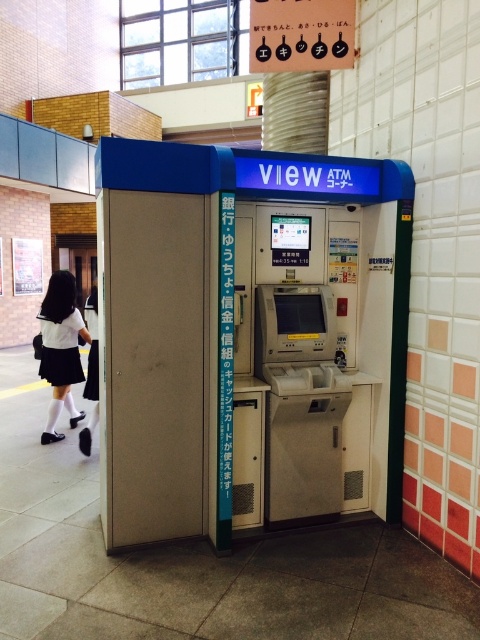
Question: Which of the following is the farthest from the observer?

Choices:
 (A) (66, 364)
 (B) (252, 397)

Answer: (A)

Question: Which point is farther to the camera?

Choices:
 (A) (216, 308)
 (B) (61, 376)

Answer: (B)

Question: Is matte plastic atm at center wider than white matte skirt at lower left?

Choices:
 (A) no
 (B) yes

Answer: (B)

Question: Is matte plastic atm at center wider than white matte skirt at lower left?

Choices:
 (A) no
 (B) yes

Answer: (B)

Question: Can you confirm if matte plastic atm at center is thinner than white matte skirt at lower left?

Choices:
 (A) yes
 (B) no

Answer: (B)